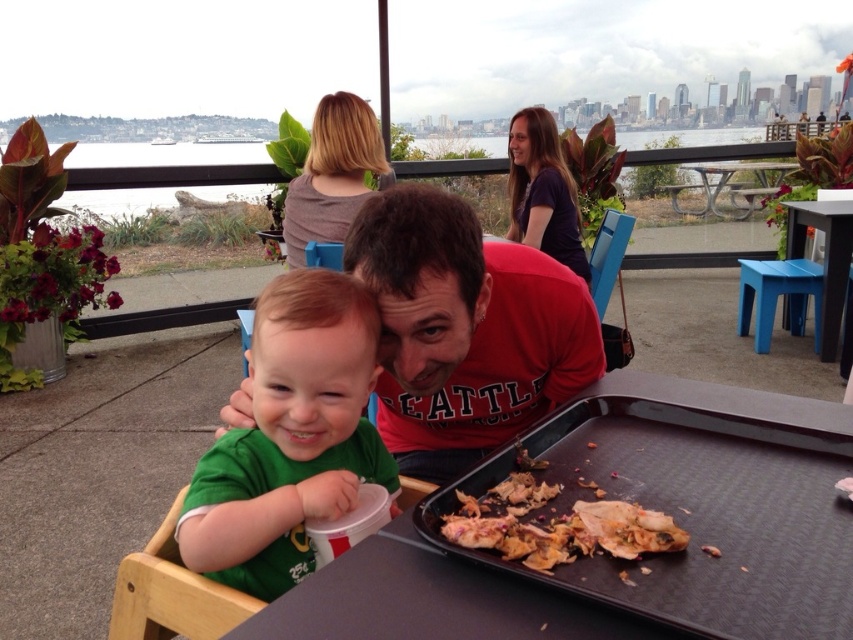
Question: Is green matte shirt at center wider than brown crumbly pizza at lower right?

Choices:
 (A) no
 (B) yes

Answer: (B)

Question: Among these points, which one is farthest from the camera?

Choices:
 (A) (282, 580)
 (B) (534, 448)
 (C) (773, 272)

Answer: (C)

Question: Which object is the closest to the black plastic tray at center?

Choices:
 (A) red matte shirt at center
 (B) green matte shirt at center
 (C) blue plastic stool at right

Answer: (A)

Question: Which point appears closest to the camera in this image?

Choices:
 (A) (843, 220)
 (B) (519, 529)
 (C) (405, 584)
 (D) (305, 397)

Answer: (C)

Question: Is red matte shirt at center bigger than brown crumbly pizza at lower right?

Choices:
 (A) no
 (B) yes

Answer: (B)

Question: Is black plastic tray at center behind green matte shirt at center?

Choices:
 (A) yes
 (B) no

Answer: (B)